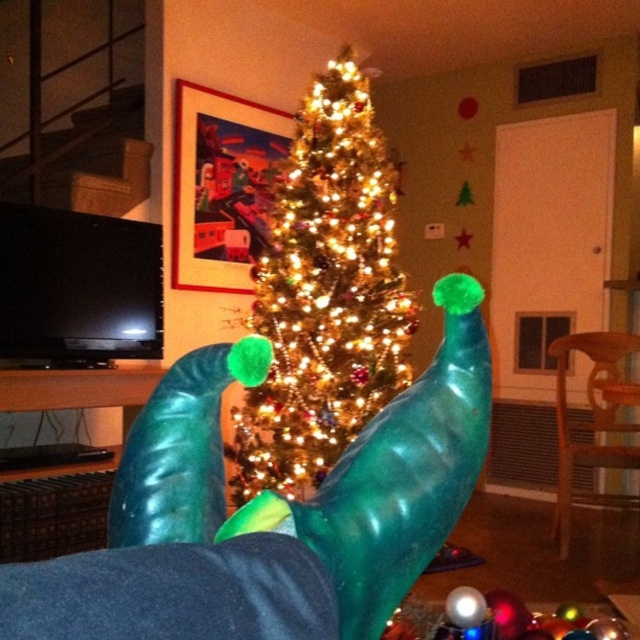
Question: Which object is farther from the camera taking this photo?

Choices:
 (A) green rubber socks at center
 (B) iridescent shiny tree at center

Answer: (B)

Question: Is green rubber socks at center behind iridescent shiny tree at center?

Choices:
 (A) yes
 (B) no

Answer: (B)

Question: Which of the following is the farthest from the observer?

Choices:
 (A) iridescent shiny tree at center
 (B) green rubber socks at center

Answer: (A)

Question: Is green rubber socks at center behind iridescent shiny tree at center?

Choices:
 (A) yes
 (B) no

Answer: (B)

Question: Which of the following is the closest to the observer?

Choices:
 (A) (352, 465)
 (B) (305, 381)

Answer: (A)

Question: Does green rubber socks at center have a greater width compared to iridescent shiny tree at center?

Choices:
 (A) yes
 (B) no

Answer: (B)